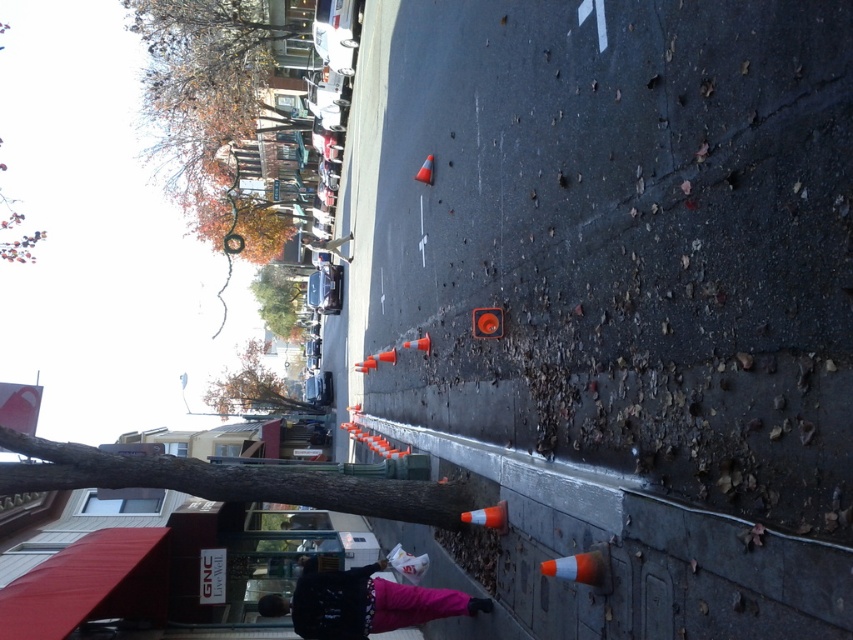
Question: Which point appears farthest from the camera in this image?

Choices:
 (A) (428, 164)
 (B) (287, 276)
 (C) (0, 28)

Answer: (C)

Question: Among these points, which one is nearest to the camera?

Choices:
 (A) (282, 403)
 (B) (432, 154)

Answer: (B)

Question: Is brown leafy tree at upper center to the right of green leafy tree at upper left from the viewer's perspective?

Choices:
 (A) yes
 (B) no

Answer: (A)

Question: Is the position of black fleece jacket at lower center less distant than that of orange reflective cone at center?

Choices:
 (A) no
 (B) yes

Answer: (B)

Question: Where is green leafy tree at upper left located in relation to orange reflective cone at lower center in the image?

Choices:
 (A) left
 (B) right

Answer: (A)

Question: Which of these objects is positioned farthest from the green leafy tree at upper center?

Choices:
 (A) orange reflective cone at lower center
 (B) black fleece jacket at lower center
 (C) orange reflective cone at center
 (D) brown leafy tree at upper center

Answer: (A)